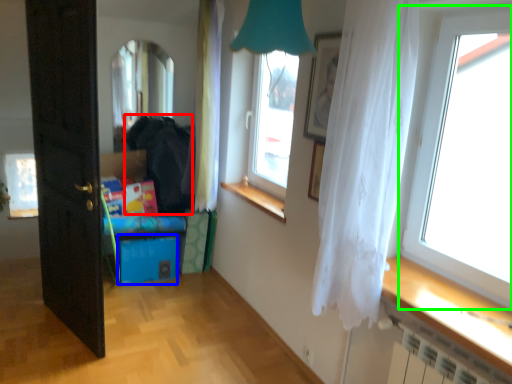
Question: Which is nearer to the dark (highlighted by a red box)? storage box (highlighted by a blue box) or window (highlighted by a green box).

Choices:
 (A) storage box
 (B) window

Answer: (A)